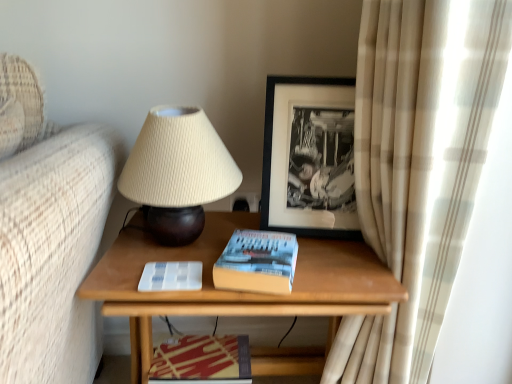
Locate an element on the screen. This screenshot has height=384, width=512. free space to the left of hardcover book at center is located at coordinates (165, 258).